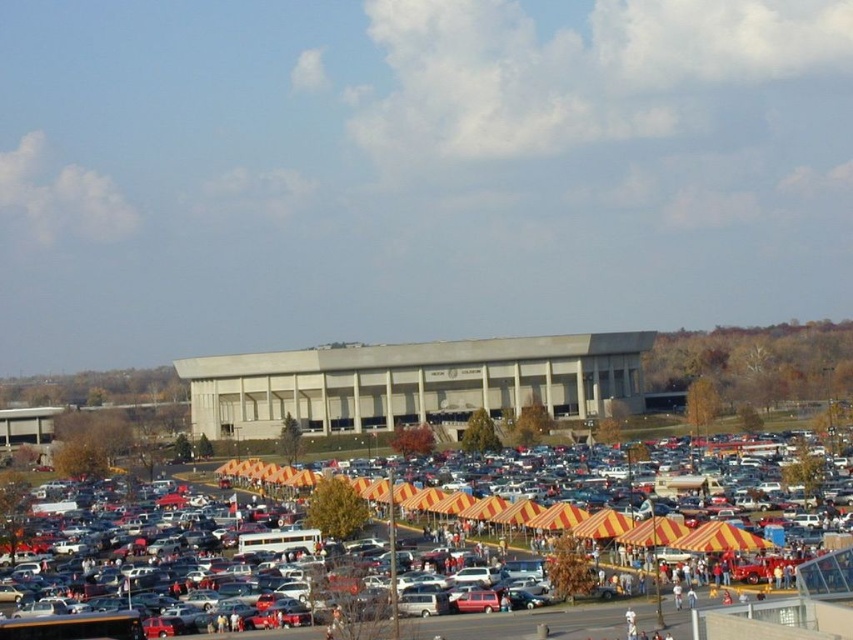
Question: Which point is closer to the camera?

Choices:
 (A) yellow striped tents at center
 (B) beige concrete building at center

Answer: (A)

Question: Is yellow striped tents at center in front of beige concrete building at center?

Choices:
 (A) yes
 (B) no

Answer: (A)

Question: Which point is farther to the camera?

Choices:
 (A) (154, 588)
 (B) (566, 339)

Answer: (B)

Question: Is yellow striped tents at center below beige concrete building at center?

Choices:
 (A) no
 (B) yes

Answer: (B)

Question: Does yellow striped tents at center appear on the right side of beige concrete building at center?

Choices:
 (A) no
 (B) yes

Answer: (B)